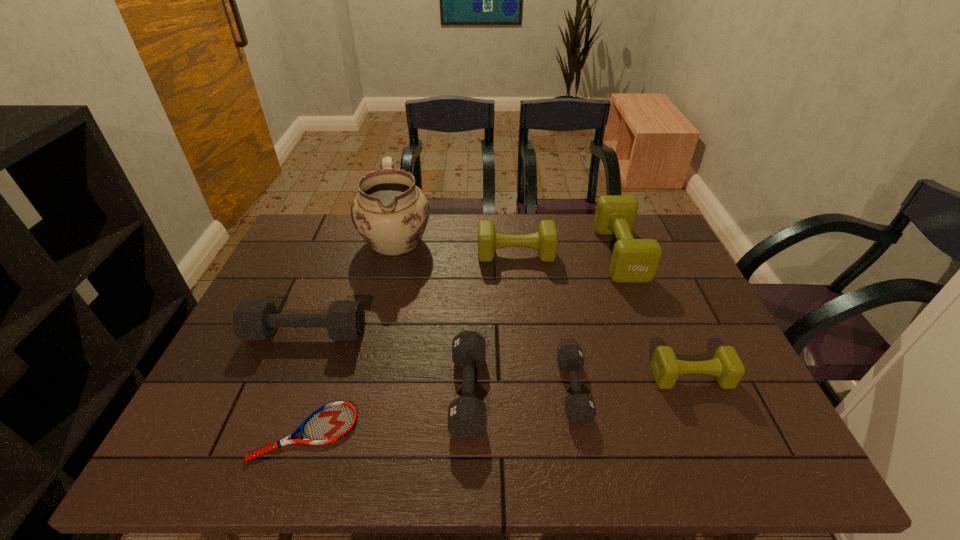
This screenshot has height=540, width=960. Identify the location of purple pitcher. pyautogui.click(x=390, y=212).

Locate an element on the screen. the tallest object is located at coordinates (390, 212).

The height and width of the screenshot is (540, 960). In order to click on the tallest dumbbell in this screenshot , I will do `click(633, 260)`.

Where is `the biggest olive dumbbell`? The image size is (960, 540). the biggest olive dumbbell is located at coordinates (x=633, y=260).

Find the location of a particular element. This screenshot has height=540, width=960. the leftmost olive dumbbell is located at coordinates (545, 240).

Where is `the farthest gray dumbbell`? This screenshot has height=540, width=960. the farthest gray dumbbell is located at coordinates (252, 319).

Locate an element on the screen. This screenshot has height=540, width=960. the leftmost dumbbell is located at coordinates (252, 319).

This screenshot has width=960, height=540. In order to click on the second gray dumbbell from right to left in this screenshot , I will do `click(466, 415)`.

The width and height of the screenshot is (960, 540). I want to click on the smallest olive dumbbell, so click(726, 366).

Locate an element on the screen. The image size is (960, 540). the shortest dumbbell is located at coordinates (580, 409).